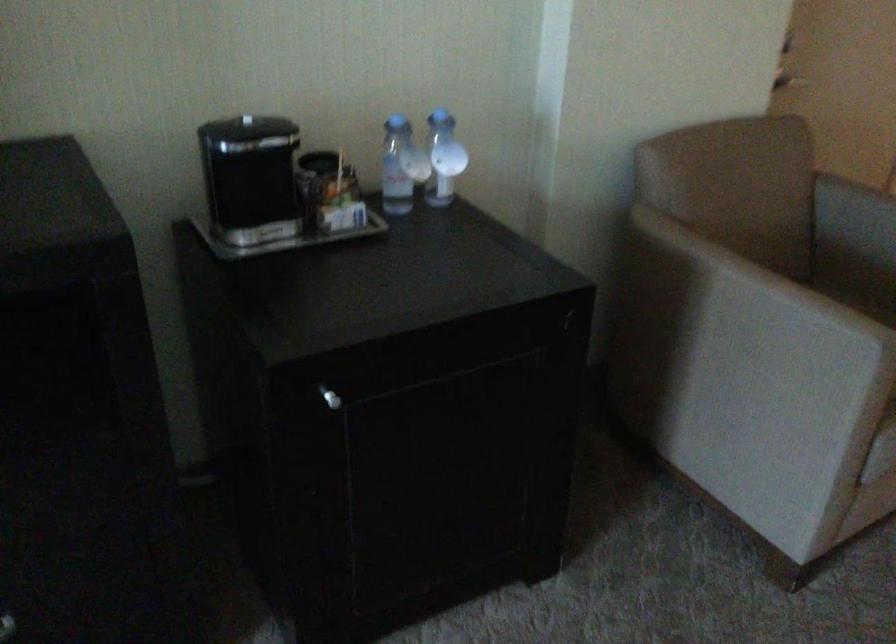
What do you see at coordinates (330, 398) in the screenshot? This screenshot has height=644, width=896. I see `the silver cabinet handle` at bounding box center [330, 398].